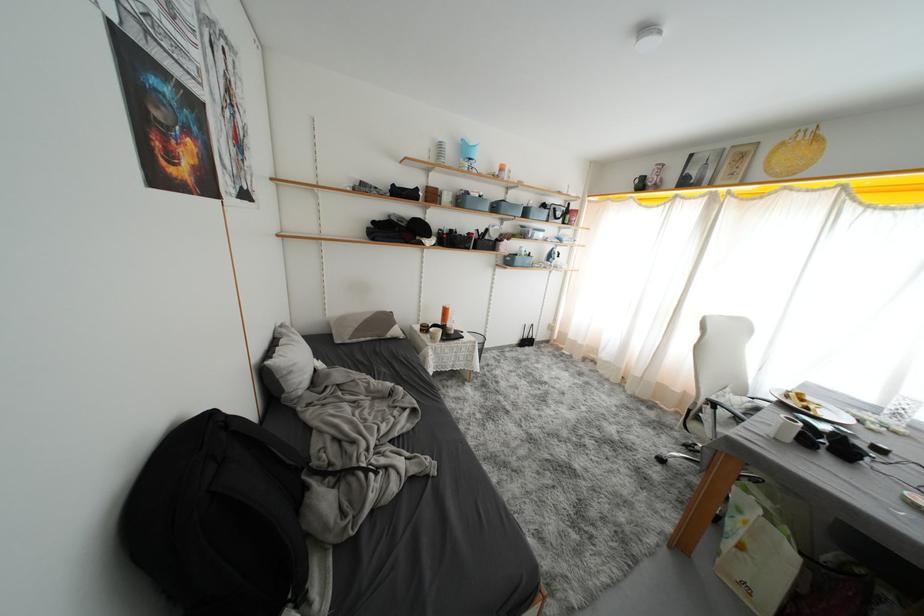
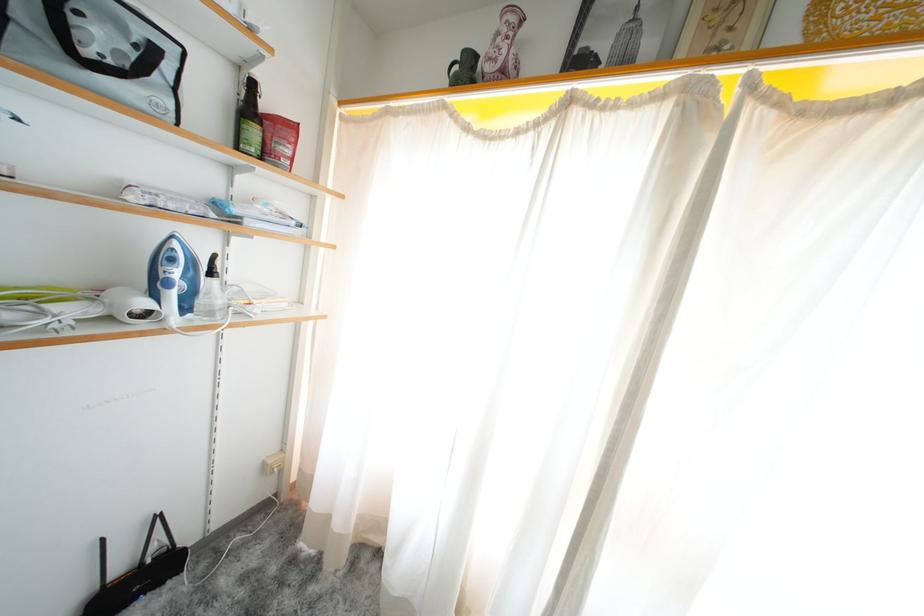
The point at (565, 336) is marked in the first image. Where is the corresponding point in the second image?

(306, 475)